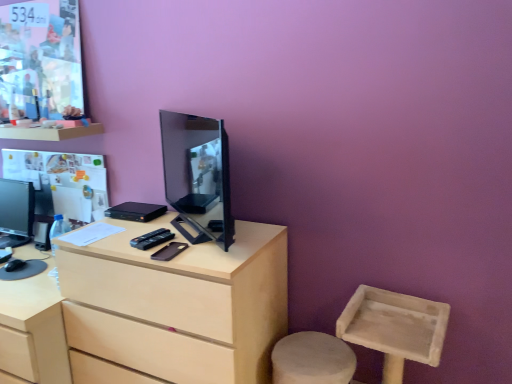
You are a GUI agent. You are given a task and a screenshot of the screen. Output one action in this format:
    pyautogui.click(x=<x>, y=<y>)
    Task: Click on the vacant region above light wood desk at center (from a real-world perspective)
    The height and width of the screenshot is (384, 512).
    Given the screenshot: What is the action you would take?
    pyautogui.click(x=155, y=226)